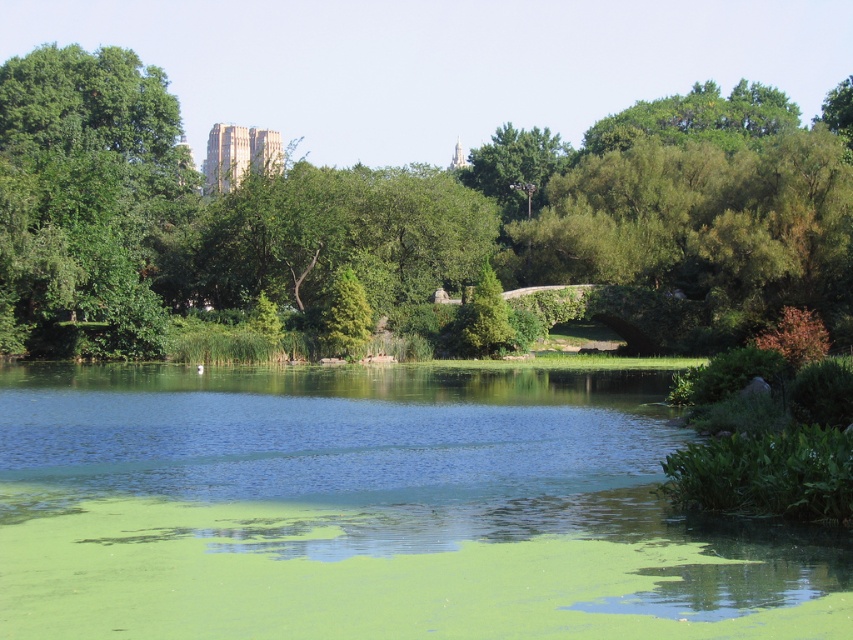
Can you confirm if green algae-covered water at center is wider than green leafy tree at center?

No, green algae-covered water at center is not wider than green leafy tree at center.

Who is more forward, (218,531) or (108,170)?

Positioned in front is point (218,531).

The image size is (853, 640). Find the location of `green algae-covered water at center`. green algae-covered water at center is located at coordinates (376, 509).

Does green algae-covered water at center appear on the right side of green leafy tree at upper left?

Result: Yes, green algae-covered water at center is to the right of green leafy tree at upper left.

Measure the distance between point (514,508) and camera.

Point (514,508) is 15.85 meters away from camera.

This screenshot has width=853, height=640. I want to click on green algae-covered water at center, so click(376, 509).

Can you confirm if green leafy tree at center is positioned to the right of green leafy tree at upper left?

Yes, green leafy tree at center is to the right of green leafy tree at upper left.

Based on the photo, can you confirm if green leafy tree at center is positioned below green leafy tree at upper left?

Incorrect, green leafy tree at center is not positioned below green leafy tree at upper left.

Where is `green leafy tree at center`? green leafy tree at center is located at coordinates (401, 211).

Identify the location of green leafy tree at center. (401, 211).